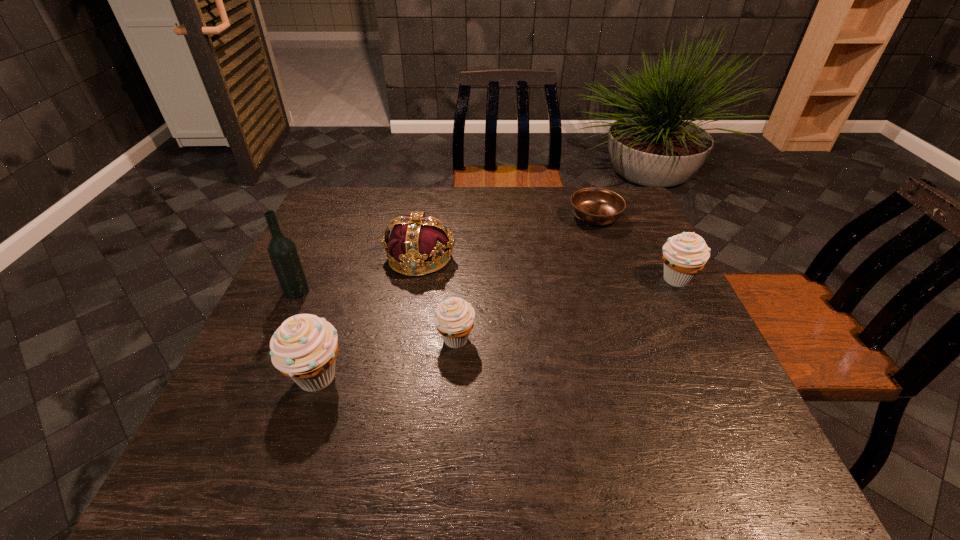
What are the coordinates of `vacant space positioned 0.290m on the back of the fifth object from right to left` in the screenshot? It's located at (354, 268).

I want to click on vacant region located 0.200m on the left of the second muffin from right to left, so click(x=347, y=340).

Where is `vacant space situated on the back of the second shortest muffin`? The width and height of the screenshot is (960, 540). vacant space situated on the back of the second shortest muffin is located at coordinates (636, 200).

Locate an element on the screen. This screenshot has height=540, width=960. vacant region located 0.340m on the front of the farthest object is located at coordinates (630, 314).

This screenshot has width=960, height=540. I want to click on vacant space located on the right of the crown, so click(x=601, y=258).

Where is `free spot located 0.130m on the front of the vodka`? free spot located 0.130m on the front of the vodka is located at coordinates pyautogui.click(x=275, y=340).

Locate an element on the screen. This screenshot has height=540, width=960. object present at the far edge is located at coordinates (596, 206).

Find the location of a particular element. This screenshot has height=540, width=960. object that is at the near edge is located at coordinates (304, 348).

Locate an element on the screen. The height and width of the screenshot is (540, 960). muffin that is positioned at the left edge is located at coordinates (304, 348).

Image resolution: width=960 pixels, height=540 pixels. Identify the location of vodka present at the left edge. (282, 251).